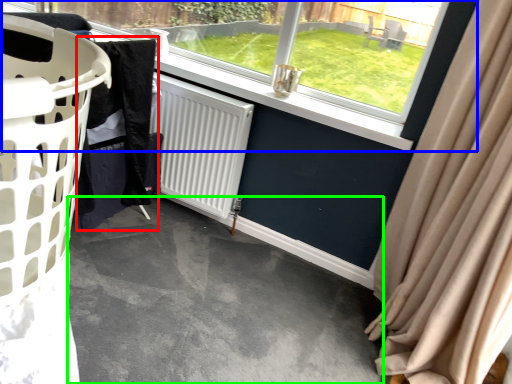
Question: Based on their relative distances, which object is nearer to clothing (highlighted by a red box)? Choose from window (highlighted by a blue box) and concrete (highlighted by a green box).

Choices:
 (A) window
 (B) concrete

Answer: (B)